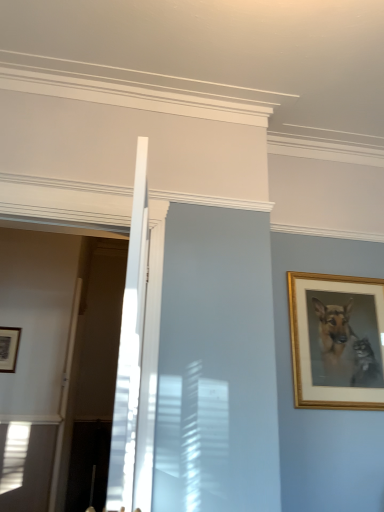
Where is `matte black picture frame at lower left, the first picture frame from the left`? The width and height of the screenshot is (384, 512). matte black picture frame at lower left, the first picture frame from the left is located at coordinates (9, 348).

What do you see at coordinates (9, 348) in the screenshot? I see `matte black picture frame at lower left, the first picture frame from the left` at bounding box center [9, 348].

What is the approximate width of gold/golden frame at right, acting as the 2th picture frame starting from the left?

1.57 inches.

The width and height of the screenshot is (384, 512). What do you see at coordinates (337, 341) in the screenshot? I see `gold/golden frame at right, acting as the 2th picture frame starting from the left` at bounding box center [337, 341].

In order to face gold/golden frame at right, placed as the 1th picture frame when sorted from front to back, should I rotate leftwards or rightwards?

Turn right approximately 19.965 degrees to face it.

You are a GUI agent. You are given a task and a screenshot of the screen. Output one action in this format:
    pyautogui.click(x=<x>, y=<y>)
    Task: Click on the gold/golden frame at right, placed as the 1th picture frame when sorted from front to back
    The width and height of the screenshot is (384, 512).
    Given the screenshot: What is the action you would take?
    pyautogui.click(x=337, y=341)

Identify the location of matte black picture frame at lower left, which is the 2th picture frame in right-to-left order. Image resolution: width=384 pixels, height=512 pixels. (9, 348).

Visually, is matte black picture frame at lower left, which is the 2th picture frame in right-to-left order, positioned to the left or to the right of gold/golden frame at right, acting as the 2th picture frame starting from the left?

Clearly, matte black picture frame at lower left, which is the 2th picture frame in right-to-left order, is on the left of gold/golden frame at right, acting as the 2th picture frame starting from the left, in the image.

Is matte black picture frame at lower left, which is counted as the second picture frame, starting from the front, in front of or behind gold/golden frame at right, arranged as the second picture frame when viewed from the back, in the image?

Visually, matte black picture frame at lower left, which is counted as the second picture frame, starting from the front, is located behind gold/golden frame at right, arranged as the second picture frame when viewed from the back.

Which point is more distant from viewer, (15,338) or (378,372)?

The point (15,338) is farther from the camera.

From the image's perspective, relative to gold/golden frame at right, which ranks as the first picture frame in right-to-left order, is matte black picture frame at lower left, the 1th picture frame viewed from the back, above or below?

matte black picture frame at lower left, the 1th picture frame viewed from the back, is below gold/golden frame at right, which ranks as the first picture frame in right-to-left order.

From a real-world perspective, between matte black picture frame at lower left, which is counted as the second picture frame, starting from the front, and gold/golden frame at right, placed as the 1th picture frame when sorted from front to back, who is vertically lower?

matte black picture frame at lower left, which is counted as the second picture frame, starting from the front, is physically lower.

Is matte black picture frame at lower left, which is counted as the second picture frame, starting from the front, wider than gold/golden frame at right, arranged as the second picture frame when viewed from the back?

In fact, matte black picture frame at lower left, which is counted as the second picture frame, starting from the front, might be narrower than gold/golden frame at right, arranged as the second picture frame when viewed from the back.

Who is shorter, matte black picture frame at lower left, the 1th picture frame viewed from the back, or gold/golden frame at right, arranged as the second picture frame when viewed from the back?

matte black picture frame at lower left, the 1th picture frame viewed from the back, is shorter.

Does matte black picture frame at lower left, which is the 2th picture frame in right-to-left order, have a larger size compared to gold/golden frame at right, which ranks as the first picture frame in right-to-left order?

No, matte black picture frame at lower left, which is the 2th picture frame in right-to-left order, is not bigger than gold/golden frame at right, which ranks as the first picture frame in right-to-left order.

Can we say matte black picture frame at lower left, which is the 2th picture frame in right-to-left order, lies outside gold/golden frame at right, arranged as the second picture frame when viewed from the back?

matte black picture frame at lower left, which is the 2th picture frame in right-to-left order, is positioned outside gold/golden frame at right, arranged as the second picture frame when viewed from the back.

Based on the photo, can you see matte black picture frame at lower left, which is counted as the second picture frame, starting from the front, touching gold/golden frame at right, which ranks as the first picture frame in right-to-left order?

No, matte black picture frame at lower left, which is counted as the second picture frame, starting from the front, is not in contact with gold/golden frame at right, which ranks as the first picture frame in right-to-left order.

Is matte black picture frame at lower left, which is the 2th picture frame in right-to-left order, facing away from gold/golden frame at right, acting as the 2th picture frame starting from the left?

No, gold/golden frame at right, acting as the 2th picture frame starting from the left, is not at the back of matte black picture frame at lower left, which is the 2th picture frame in right-to-left order.

What's the angular difference between matte black picture frame at lower left, which is the 2th picture frame in right-to-left order, and gold/golden frame at right, arranged as the second picture frame when viewed from the back,'s facing directions?

The angle between the facing direction of matte black picture frame at lower left, which is the 2th picture frame in right-to-left order, and the facing direction of gold/golden frame at right, arranged as the second picture frame when viewed from the back, is 1.13 degrees.

The width and height of the screenshot is (384, 512). Identify the location of picture frame that is behind the gold/golden frame at right, which ranks as the first picture frame in right-to-left order. (9, 348).

Based on the photo, is gold/golden frame at right, placed as the 1th picture frame when sorted from front to back, to the right of matte black picture frame at lower left, the first picture frame from the left, from the viewer's perspective?

Correct, you'll find gold/golden frame at right, placed as the 1th picture frame when sorted from front to back, to the right of matte black picture frame at lower left, the first picture frame from the left.

From the picture: In the image, is gold/golden frame at right, which ranks as the first picture frame in right-to-left order, positioned in front of or behind matte black picture frame at lower left, the first picture frame from the left?

In the image, gold/golden frame at right, which ranks as the first picture frame in right-to-left order, appears in front of matte black picture frame at lower left, the first picture frame from the left.

Is point (383, 319) closer to camera compared to point (9, 339)?

That is True.

From the image's perspective, between gold/golden frame at right, acting as the 2th picture frame starting from the left, and matte black picture frame at lower left, the first picture frame from the left, who is located below?

matte black picture frame at lower left, the first picture frame from the left, appears lower in the image.

From a real-world perspective, is gold/golden frame at right, acting as the 2th picture frame starting from the left, physically located above or below matte black picture frame at lower left, the first picture frame from the left?

In terms of real-world spatial position, gold/golden frame at right, acting as the 2th picture frame starting from the left, is above matte black picture frame at lower left, the first picture frame from the left.

Is gold/golden frame at right, placed as the 1th picture frame when sorted from front to back, wider than matte black picture frame at lower left, the first picture frame from the left?

Yes, gold/golden frame at right, placed as the 1th picture frame when sorted from front to back, is wider than matte black picture frame at lower left, the first picture frame from the left.

Who is taller, gold/golden frame at right, acting as the 2th picture frame starting from the left, or matte black picture frame at lower left, which is the 2th picture frame in right-to-left order?

With more height is gold/golden frame at right, acting as the 2th picture frame starting from the left.

Can you confirm if gold/golden frame at right, arranged as the second picture frame when viewed from the back, is bigger than matte black picture frame at lower left, the 1th picture frame viewed from the back?

Yes, gold/golden frame at right, arranged as the second picture frame when viewed from the back, is bigger than matte black picture frame at lower left, the 1th picture frame viewed from the back.

In the scene shown: Would you say gold/golden frame at right, placed as the 1th picture frame when sorted from front to back, contains matte black picture frame at lower left, the first picture frame from the left?

No, gold/golden frame at right, placed as the 1th picture frame when sorted from front to back, does not contain matte black picture frame at lower left, the first picture frame from the left.

Can you see gold/golden frame at right, placed as the 1th picture frame when sorted from front to back, touching matte black picture frame at lower left, the 1th picture frame viewed from the back?

No, gold/golden frame at right, placed as the 1th picture frame when sorted from front to back, is not touching matte black picture frame at lower left, the 1th picture frame viewed from the back.

Is gold/golden frame at right, arranged as the second picture frame when viewed from the back, oriented away from matte black picture frame at lower left, the 1th picture frame viewed from the back?

No, gold/golden frame at right, arranged as the second picture frame when viewed from the back, is not facing away from matte black picture frame at lower left, the 1th picture frame viewed from the back.

How many degrees apart are the facing directions of gold/golden frame at right, acting as the 2th picture frame starting from the left, and matte black picture frame at lower left, the 1th picture frame viewed from the back?

gold/golden frame at right, acting as the 2th picture frame starting from the left, and matte black picture frame at lower left, the 1th picture frame viewed from the back, are facing 1.13 degrees away from each other.

Where is `picture frame below the gold/golden frame at right, placed as the 1th picture frame when sorted from front to back (from the image's perspective)`? picture frame below the gold/golden frame at right, placed as the 1th picture frame when sorted from front to back (from the image's perspective) is located at coordinates (9, 348).

Locate an element on the screen. Image resolution: width=384 pixels, height=512 pixels. picture frame on the left side of gold/golden frame at right, placed as the 1th picture frame when sorted from front to back is located at coordinates (9, 348).

Where is `picture frame above the matte black picture frame at lower left, which is the 2th picture frame in right-to-left order (from a real-world perspective)`? picture frame above the matte black picture frame at lower left, which is the 2th picture frame in right-to-left order (from a real-world perspective) is located at coordinates (337, 341).